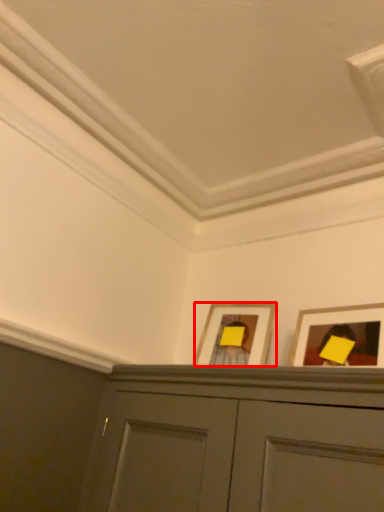
Question: From the image, what is the correct spatial relationship of picture frame (annotated by the red box) in relation to picture frame?

Choices:
 (A) left
 (B) right

Answer: (A)